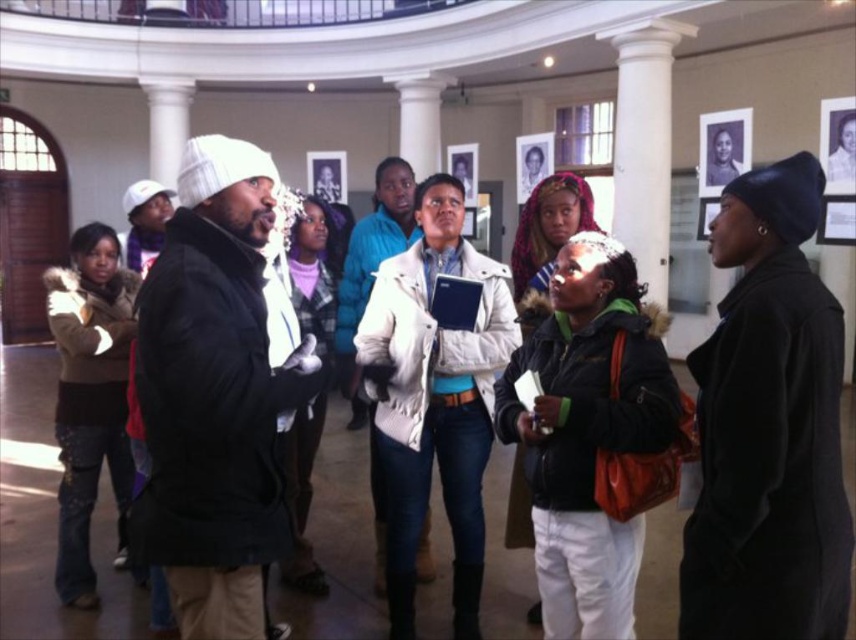
Between white knit hat at center and light beige jacket at center, which one has more height?

light beige jacket at center is taller.

Between point (194, 461) and point (473, 355), which one is positioned behind?

Positioned behind is point (473, 355).

Find the location of `white knit hat at center`. white knit hat at center is located at coordinates (217, 392).

Which is below, white knit hat at center or green fuzzy jacket at center?

green fuzzy jacket at center is below.

Is white knit hat at center to the right of green fuzzy jacket at center from the viewer's perspective?

Incorrect, white knit hat at center is not on the right side of green fuzzy jacket at center.

Which is in front, point (218, 508) or point (550, 326)?

Point (218, 508) is in front.

The width and height of the screenshot is (856, 640). I want to click on white knit hat at center, so click(217, 392).

Consider the image. Can you confirm if green fuzzy jacket at center is bigger than light beige jacket at center?

Incorrect, green fuzzy jacket at center is not larger than light beige jacket at center.

Who is shorter, green fuzzy jacket at center or light beige jacket at center?

green fuzzy jacket at center

Identify the location of green fuzzy jacket at center. (587, 429).

This screenshot has height=640, width=856. I want to click on green fuzzy jacket at center, so click(x=587, y=429).